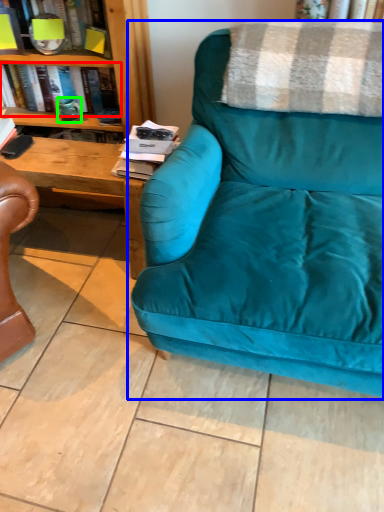
Question: Considering the real-world distances, which object is farthest from book (highlighted by a red box)? studio couch (highlighted by a blue box) or teal (highlighted by a green box)?

Choices:
 (A) studio couch
 (B) teal

Answer: (A)